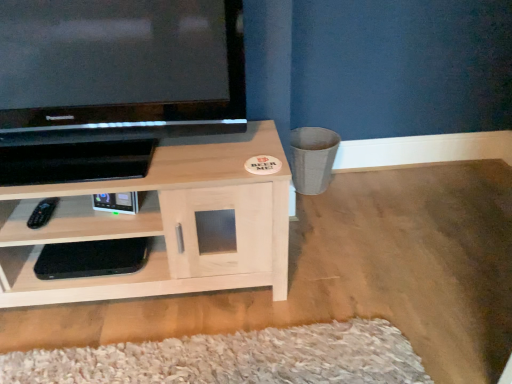
Describe the element at coordinates (42, 213) in the screenshot. I see `black plastic remote at lower left` at that location.

This screenshot has height=384, width=512. Describe the element at coordinates (161, 224) in the screenshot. I see `light wood/woodenobject at lower left, the 1th shelf from the top` at that location.

Where is `black plastic remote at lower left`? black plastic remote at lower left is located at coordinates (42, 213).

Looking at this image, is black glossy television at upper left further to the viewer compared to light wood/woodenobject at lower left, the 1th shelf from the top?

No.

This screenshot has width=512, height=384. I want to click on television in front of the light wood/woodenobject at lower left, the 1th shelf from the top, so click(119, 69).

Is the surface of black glossy television at upper left in direct contact with light wood/woodenobject at lower left, the 1th shelf from the top?

No, black glossy television at upper left is not touching light wood/woodenobject at lower left, the 1th shelf from the top.

From a real-world perspective, is black glossy television at upper left under light wood/woodenobject at lower left, the 1th shelf from the top?

No.

You are a GUI agent. You are given a task and a screenshot of the screen. Output one action in this format:
    pyautogui.click(x=<x>, y=<y>)
    Task: Click on the television above the black plastic remote at lower left (from the image's perspective)
    The height and width of the screenshot is (384, 512).
    Given the screenshot: What is the action you would take?
    pyautogui.click(x=119, y=69)

Is black glossy television at upper left taller than black plastic remote at lower left?

Yes, black glossy television at upper left is taller than black plastic remote at lower left.

Between black glossy television at upper left and black plastic remote at lower left, which one has smaller width?

With smaller width is black plastic remote at lower left.

Who is taller, black matte console at lower left, which ranks as the 2th shelf in top-to-bottom order, or black plastic remote at lower left?

black matte console at lower left, which ranks as the 2th shelf in top-to-bottom order.

Looking at this image, can you confirm if black matte console at lower left, marked as the first shelf in a bottom-to-top arrangement, is bigger than black plastic remote at lower left?

Yes, black matte console at lower left, marked as the first shelf in a bottom-to-top arrangement, is bigger than black plastic remote at lower left.

Considering the positions of objects black matte console at lower left, which ranks as the 2th shelf in top-to-bottom order, and black plastic remote at lower left in the image provided, who is behind, black matte console at lower left, which ranks as the 2th shelf in top-to-bottom order, or black plastic remote at lower left?

Positioned behind is black matte console at lower left, which ranks as the 2th shelf in top-to-bottom order.

Identify the location of the 2nd shelf counting from the left side of the black glossy television at upper left. (76, 278).

Looking at this image, is black matte console at lower left, marked as the first shelf in a bottom-to-top arrangement, oriented away from black glossy television at upper left?

No, black matte console at lower left, marked as the first shelf in a bottom-to-top arrangement,'s orientation is not away from black glossy television at upper left.

Between point (170, 278) and point (175, 102), which one is positioned behind?

Positioned behind is point (170, 278).

Would you consider black matte console at lower left, which ranks as the 2th shelf in top-to-bottom order, to be distant from black glossy television at upper left?

No.

Relative to black matte console at lower left, marked as the first shelf in a bottom-to-top arrangement, is black glossy television at upper left in front or behind?

In the image, black glossy television at upper left appears in front of black matte console at lower left, marked as the first shelf in a bottom-to-top arrangement.

Considering the points (36, 55) and (32, 253), which point is in front, point (36, 55) or point (32, 253)?

The point (36, 55) is closer.

From a real-world perspective, is black glossy television at upper left physically above black matte console at lower left, which ranks as the 2th shelf in top-to-bottom order?

Yes, from a real-world perspective, black glossy television at upper left is above black matte console at lower left, which ranks as the 2th shelf in top-to-bottom order.

Considering the relative positions of black glossy television at upper left and black matte console at lower left, marked as the first shelf in a bottom-to-top arrangement, in the image provided, is black glossy television at upper left to the left of black matte console at lower left, marked as the first shelf in a bottom-to-top arrangement, from the viewer's perspective?

No, black glossy television at upper left is not to the left of black matte console at lower left, marked as the first shelf in a bottom-to-top arrangement.

From the image's perspective, between light wood/woodenobject at lower left, the 1th shelf from the top, and black matte console at lower left, which ranks as the 2th shelf in top-to-bottom order, who is located below?

black matte console at lower left, which ranks as the 2th shelf in top-to-bottom order, appears lower in the image.

Between light wood/woodenobject at lower left, the second shelf when ordered from bottom to top, and black matte console at lower left, which ranks as the 2th shelf in top-to-bottom order, which one has smaller width?

black matte console at lower left, which ranks as the 2th shelf in top-to-bottom order.

Are light wood/woodenobject at lower left, the 1th shelf from the top, and black matte console at lower left, which ranks as the 2th shelf in top-to-bottom order, located far from each other?

Actually, light wood/woodenobject at lower left, the 1th shelf from the top, and black matte console at lower left, which ranks as the 2th shelf in top-to-bottom order, are a little close together.

Can you confirm if light wood/woodenobject at lower left, the 1th shelf from the top, is smaller than black matte console at lower left, marked as the first shelf in a bottom-to-top arrangement?

Actually, light wood/woodenobject at lower left, the 1th shelf from the top, might be larger than black matte console at lower left, marked as the first shelf in a bottom-to-top arrangement.

Based on the photo, in terms of width, does black plastic remote at lower left look wider or thinner when compared to light wood/woodenobject at lower left, the 1th shelf from the top?

black plastic remote at lower left is thinner than light wood/woodenobject at lower left, the 1th shelf from the top.

Consider the image. Is black plastic remote at lower left further to camera compared to light wood/woodenobject at lower left, the 1th shelf from the top?

Yes, black plastic remote at lower left is behind light wood/woodenobject at lower left, the 1th shelf from the top.

Who is shorter, black plastic remote at lower left or light wood/woodenobject at lower left, the second shelf when ordered from bottom to top?

black plastic remote at lower left is shorter.

Find the location of `the 1st shelf below the black glossy television at upper left (from the image's perspective)`. the 1st shelf below the black glossy television at upper left (from the image's perspective) is located at coordinates (161, 224).

The width and height of the screenshot is (512, 384). Find the location of `television that is on the right side of black plastic remote at lower left`. television that is on the right side of black plastic remote at lower left is located at coordinates (119, 69).

Based on their spatial positions, is black plastic remote at lower left or light wood/woodenobject at lower left, the second shelf when ordered from bottom to top, closer to black glossy television at upper left?

The object closer to black glossy television at upper left is light wood/woodenobject at lower left, the second shelf when ordered from bottom to top.

Based on their spatial positions, is light wood/woodenobject at lower left, the second shelf when ordered from bottom to top, or black glossy television at upper left closer to black plastic remote at lower left?

Among the two, light wood/woodenobject at lower left, the second shelf when ordered from bottom to top, is located nearer to black plastic remote at lower left.

Which object lies nearer to the anchor point black plastic remote at lower left, black matte console at lower left, which ranks as the 2th shelf in top-to-bottom order, or black glossy television at upper left?

black matte console at lower left, which ranks as the 2th shelf in top-to-bottom order, is closer to black plastic remote at lower left.

Based on their spatial positions, is black plastic remote at lower left or light wood/woodenobject at lower left, the second shelf when ordered from bottom to top, further from black matte console at lower left, marked as the first shelf in a bottom-to-top arrangement?

The object further to black matte console at lower left, marked as the first shelf in a bottom-to-top arrangement, is black plastic remote at lower left.

Based on their spatial positions, is black glossy television at upper left or black plastic remote at lower left further from light wood/woodenobject at lower left, the second shelf when ordered from bottom to top?

black plastic remote at lower left.

From the image, which object appears to be farther from black matte console at lower left, which ranks as the 2th shelf in top-to-bottom order, light wood/woodenobject at lower left, the second shelf when ordered from bottom to top, or black glossy television at upper left?

The object further to black matte console at lower left, which ranks as the 2th shelf in top-to-bottom order, is black glossy television at upper left.

From the image, which object appears to be farther from light wood/woodenobject at lower left, the 1th shelf from the top, black matte console at lower left, which ranks as the 2th shelf in top-to-bottom order, or black glossy television at upper left?

black glossy television at upper left is further to light wood/woodenobject at lower left, the 1th shelf from the top.

Looking at the image, which one is located closer to black matte console at lower left, which ranks as the 2th shelf in top-to-bottom order, black glossy television at upper left or black plastic remote at lower left?

Among the two, black plastic remote at lower left is located nearer to black matte console at lower left, which ranks as the 2th shelf in top-to-bottom order.

Locate an element on the screen. The width and height of the screenshot is (512, 384). remote between black glossy television at upper left and black matte console at lower left, marked as the first shelf in a bottom-to-top arrangement, from top to bottom is located at coordinates (42, 213).

The width and height of the screenshot is (512, 384). What are the coordinates of `remote between black glossy television at upper left and light wood/woodenobject at lower left, the 1th shelf from the top, in the up-down direction` in the screenshot? It's located at (42, 213).

Where is `shelf situated between black plastic remote at lower left and light wood/woodenobject at lower left, the second shelf when ordered from bottom to top, from left to right`? This screenshot has height=384, width=512. shelf situated between black plastic remote at lower left and light wood/woodenobject at lower left, the second shelf when ordered from bottom to top, from left to right is located at coordinates (76, 278).

The height and width of the screenshot is (384, 512). I want to click on shelf between black glossy television at upper left and black matte console at lower left, which ranks as the 2th shelf in top-to-bottom order, from top to bottom, so tap(161, 224).